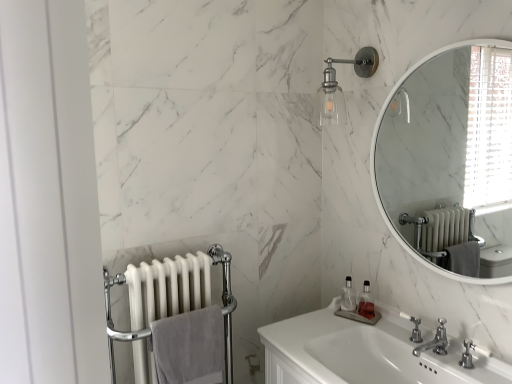
Measure the distance between point (190, 350) and camera.

Point (190, 350) and camera are 5.06 feet apart.

Where is `clear glass sconce at upper center`? Image resolution: width=512 pixels, height=384 pixels. clear glass sconce at upper center is located at coordinates pos(340,87).

Find the location of a particular element. The image size is (512, 384). white plastic faucet at lower right, the first plumbing fixture positioned from the back is located at coordinates (414, 327).

What do you see at coordinates (435, 341) in the screenshot? The width and height of the screenshot is (512, 384). I see `chrome metallic faucet at lower right, the 1th plumbing fixture in the front-to-back sequence` at bounding box center [435, 341].

What are the coordinates of `chrome metallic faucet at lower right, the 1th plumbing fixture in the front-to-back sequence` in the screenshot? It's located at (435, 341).

The width and height of the screenshot is (512, 384). I want to click on gray cotton towel at lower left, so click(189, 347).

Between translucent glass soap dispenser at lower center, which is counted as the 2th soap dispenser, starting from the left, and clear plastic soap dispenser at lower center, positioned as the 1th soap dispenser in left-to-right order, which one appears on the left side from the viewer's perspective?

From the viewer's perspective, clear plastic soap dispenser at lower center, positioned as the 1th soap dispenser in left-to-right order, appears more on the left side.

Is translucent glass soap dispenser at lower center, which is counted as the 2th soap dispenser, starting from the left, smaller than clear plastic soap dispenser at lower center, which is the second soap dispenser in right-to-left order?

Correct, translucent glass soap dispenser at lower center, which is counted as the 2th soap dispenser, starting from the left, occupies less space than clear plastic soap dispenser at lower center, which is the second soap dispenser in right-to-left order.

In the scene shown: Which of these two, translucent glass soap dispenser at lower center, arranged as the 1th soap dispenser when viewed from the right, or clear plastic soap dispenser at lower center, which is the second soap dispenser in right-to-left order, stands shorter?

Standing shorter between the two is translucent glass soap dispenser at lower center, arranged as the 1th soap dispenser when viewed from the right.

In the image, is translucent glass soap dispenser at lower center, which is counted as the 2th soap dispenser, starting from the left, positioned in front of or behind clear plastic soap dispenser at lower center, positioned as the 1th soap dispenser in left-to-right order?

translucent glass soap dispenser at lower center, which is counted as the 2th soap dispenser, starting from the left, is in front of clear plastic soap dispenser at lower center, positioned as the 1th soap dispenser in left-to-right order.

Is clear glass sconce at upper center positioned far away from clear plastic soap dispenser at lower center, which is the second soap dispenser in right-to-left order?

clear glass sconce at upper center is actually quite close to clear plastic soap dispenser at lower center, which is the second soap dispenser in right-to-left order.

Is point (359, 66) closer or farther from the camera than point (351, 282)?

Point (359, 66).

Is clear glass sconce at upper center positioned with its back to clear plastic soap dispenser at lower center, positioned as the 1th soap dispenser in left-to-right order?

clear glass sconce at upper center does not have its back to clear plastic soap dispenser at lower center, positioned as the 1th soap dispenser in left-to-right order.

Find the location of a particular element. shower above the clear plastic soap dispenser at lower center, positioned as the 1th soap dispenser in left-to-right order (from the image's perspective) is located at coordinates (340, 87).

Looking at this image, from a real-world perspective, is gray cotton towel at lower left beneath clear plastic soap dispenser at lower center, which is the second soap dispenser in right-to-left order?

Yes, from a real-world perspective, gray cotton towel at lower left is beneath clear plastic soap dispenser at lower center, which is the second soap dispenser in right-to-left order.

Does gray cotton towel at lower left turn towards clear plastic soap dispenser at lower center, which is the second soap dispenser in right-to-left order?

No, gray cotton towel at lower left is not turned towards clear plastic soap dispenser at lower center, which is the second soap dispenser in right-to-left order.

From the picture: From the image's perspective, is gray cotton towel at lower left above or below clear plastic soap dispenser at lower center, which is the second soap dispenser in right-to-left order?

Based on their image positions, gray cotton towel at lower left is located beneath clear plastic soap dispenser at lower center, which is the second soap dispenser in right-to-left order.

Between translucent glass soap dispenser at lower center, arranged as the 1th soap dispenser when viewed from the right, and white glossy sink at center, which one has less height?

translucent glass soap dispenser at lower center, arranged as the 1th soap dispenser when viewed from the right.

Who is smaller, translucent glass soap dispenser at lower center, arranged as the 1th soap dispenser when viewed from the right, or white glossy sink at center?

With smaller size is translucent glass soap dispenser at lower center, arranged as the 1th soap dispenser when viewed from the right.

Could you tell me if translucent glass soap dispenser at lower center, arranged as the 1th soap dispenser when viewed from the right, is turned towards white glossy sink at center?

No, translucent glass soap dispenser at lower center, arranged as the 1th soap dispenser when viewed from the right, is not oriented towards white glossy sink at center.

Identify the location of soap dispenser that is the 1st object above the white glossy sink at center (from a real-world perspective). (366, 302).

Would you say chrome metallic faucet at lower right, the 1th plumbing fixture in the front-to-back sequence, is to the left or to the right of translucent glass soap dispenser at lower center, arranged as the 1th soap dispenser when viewed from the right, in the picture?

From the image, it's evident that chrome metallic faucet at lower right, the 1th plumbing fixture in the front-to-back sequence, is to the right of translucent glass soap dispenser at lower center, arranged as the 1th soap dispenser when viewed from the right.

Is chrome metallic faucet at lower right, positioned as the second plumbing fixture in back-to-front order, spatially inside translucent glass soap dispenser at lower center, which is counted as the 2th soap dispenser, starting from the left, or outside of it?

chrome metallic faucet at lower right, positioned as the second plumbing fixture in back-to-front order, cannot be found inside translucent glass soap dispenser at lower center, which is counted as the 2th soap dispenser, starting from the left.

Is translucent glass soap dispenser at lower center, which is counted as the 2th soap dispenser, starting from the left, positioned beyond the bounds of gray cotton towel at lower left?

Yes, translucent glass soap dispenser at lower center, which is counted as the 2th soap dispenser, starting from the left, is not within gray cotton towel at lower left.

How many degrees apart are the facing directions of translucent glass soap dispenser at lower center, which is counted as the 2th soap dispenser, starting from the left, and gray cotton towel at lower left?

66.8 degrees separate the facing orientations of translucent glass soap dispenser at lower center, which is counted as the 2th soap dispenser, starting from the left, and gray cotton towel at lower left.

Is translucent glass soap dispenser at lower center, arranged as the 1th soap dispenser when viewed from the right, positioned with its back to gray cotton towel at lower left?

No, gray cotton towel at lower left is not at the back of translucent glass soap dispenser at lower center, arranged as the 1th soap dispenser when viewed from the right.

Is translucent glass soap dispenser at lower center, which is counted as the 2th soap dispenser, starting from the left, with gray cotton towel at lower left?

No, translucent glass soap dispenser at lower center, which is counted as the 2th soap dispenser, starting from the left, is not with gray cotton towel at lower left.

Is white glossy sink at center located outside white glossy radiator at left?

white glossy sink at center lies outside white glossy radiator at left's area.

Is white glossy sink at center touching white glossy radiator at left?

No, white glossy sink at center is not touching white glossy radiator at left.

Could you tell me if white glossy sink at center is turned towards white glossy radiator at left?

Yes, white glossy sink at center is turned towards white glossy radiator at left.

Does white glossy sink at center come behind white glossy radiator at left?

No.

Where is `soap dispenser above the translucent glass soap dispenser at lower center, arranged as the 1th soap dispenser when viewed from the right (from a real-world perspective)`? The image size is (512, 384). soap dispenser above the translucent glass soap dispenser at lower center, arranged as the 1th soap dispenser when viewed from the right (from a real-world perspective) is located at coordinates (348, 296).

Find the location of a particular element. Image resolution: width=512 pixels, height=384 pixels. the 1st soap dispenser to the right when counting from the clear glass sconce at upper center is located at coordinates coord(348,296).

Considering their positions, is gray cotton towel at lower left positioned further to white glossy radiator at left than clear plastic soap dispenser at lower center, which is the second soap dispenser in right-to-left order?

clear plastic soap dispenser at lower center, which is the second soap dispenser in right-to-left order, is positioned further to the anchor white glossy radiator at left.

Considering their positions, is white glossy sink at center positioned further to chrome metallic faucet at lower right, positioned as the second plumbing fixture in back-to-front order, than clear plastic soap dispenser at lower center, which is the second soap dispenser in right-to-left order?

Among the two, clear plastic soap dispenser at lower center, which is the second soap dispenser in right-to-left order, is located further to chrome metallic faucet at lower right, positioned as the second plumbing fixture in back-to-front order.

Estimate the real-world distances between objects in this image. Which object is further from chrome metallic faucet at lower right, the 1th plumbing fixture in the front-to-back sequence, white plastic faucet at lower right, the second plumbing fixture positioned from the front, or gray cotton towel at lower left?

Among the two, gray cotton towel at lower left is located further to chrome metallic faucet at lower right, the 1th plumbing fixture in the front-to-back sequence.

Which object lies nearer to the anchor point clear glass sconce at upper center, translucent glass soap dispenser at lower center, which is counted as the 2th soap dispenser, starting from the left, or chrome metallic faucet at lower right, the 1th plumbing fixture in the front-to-back sequence?

translucent glass soap dispenser at lower center, which is counted as the 2th soap dispenser, starting from the left.

Which object lies nearer to the anchor point clear plastic soap dispenser at lower center, positioned as the 1th soap dispenser in left-to-right order, translucent glass soap dispenser at lower center, which is counted as the 2th soap dispenser, starting from the left, or chrome metallic faucet at lower right, positioned as the second plumbing fixture in back-to-front order?

The object closer to clear plastic soap dispenser at lower center, positioned as the 1th soap dispenser in left-to-right order, is translucent glass soap dispenser at lower center, which is counted as the 2th soap dispenser, starting from the left.

Looking at the image, which one is located further to white plastic faucet at lower right, the second plumbing fixture positioned from the front, gray cotton towel at lower left or clear glass sconce at upper center?

clear glass sconce at upper center.

When comparing their distances from white glossy radiator at left, does gray cotton towel at lower left or translucent glass soap dispenser at lower center, which is counted as the 2th soap dispenser, starting from the left, seem further?

translucent glass soap dispenser at lower center, which is counted as the 2th soap dispenser, starting from the left, is positioned further to the anchor white glossy radiator at left.

Looking at the image, which one is located further to clear glass sconce at upper center, white glossy radiator at left or white plastic faucet at lower right, the first plumbing fixture positioned from the back?

white glossy radiator at left.

Where is `plumbing fixture between chrome metallic faucet at lower right, positioned as the second plumbing fixture in back-to-front order, and clear plastic soap dispenser at lower center, positioned as the 1th soap dispenser in left-to-right order, from front to back`? This screenshot has height=384, width=512. plumbing fixture between chrome metallic faucet at lower right, positioned as the second plumbing fixture in back-to-front order, and clear plastic soap dispenser at lower center, positioned as the 1th soap dispenser in left-to-right order, from front to back is located at coordinates coord(414,327).

Image resolution: width=512 pixels, height=384 pixels. What are the coordinates of `sink located between white glossy radiator at left and translucent glass soap dispenser at lower center, which is counted as the 2th soap dispenser, starting from the left, in the left-right direction` in the screenshot? It's located at (362, 353).

What are the coordinates of `plumbing fixture between white glossy sink at center and white plastic faucet at lower right, the first plumbing fixture positioned from the back, in the front-back direction` in the screenshot? It's located at (435, 341).

You are a GUI agent. You are given a task and a screenshot of the screen. Output one action in this format:
    pyautogui.click(x=<x>, y=<y>)
    Task: Click on the bath towel between clear glass sconce at upper center and white glossy sink at center in the vertical direction
    Image resolution: width=512 pixels, height=384 pixels.
    Given the screenshot: What is the action you would take?
    pyautogui.click(x=189, y=347)